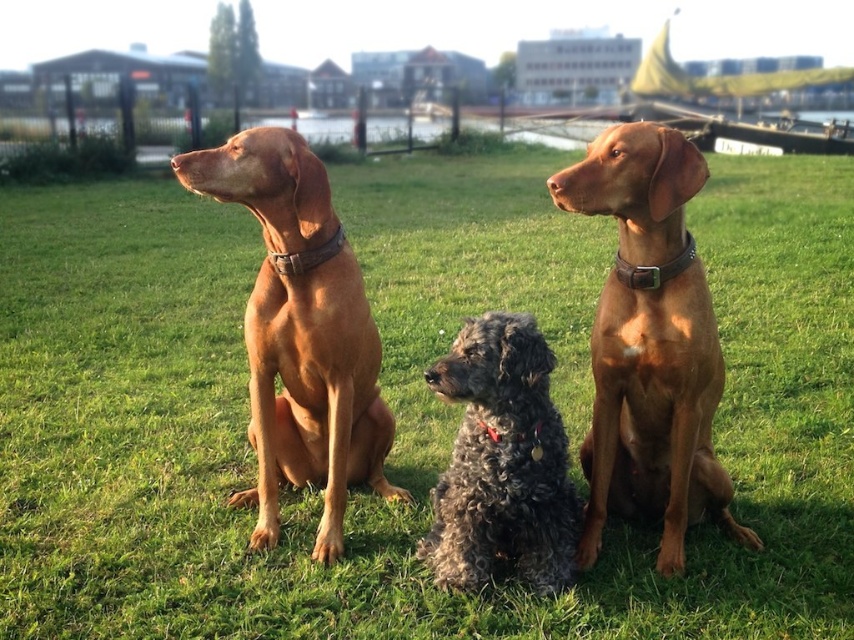
Is point (607, 364) positioned behind point (306, 369)?

No.

Does matte brown dog at center have a lesser height compared to brown leather dog at left?

Yes.

Between point (617, 205) and point (314, 330), which one is positioned behind?

The point (314, 330) is more distant.

This screenshot has width=854, height=640. I want to click on matte brown dog at center, so click(x=650, y=344).

Which is above, matte brown dog at center or curly gray fur at center?

Positioned higher is matte brown dog at center.

This screenshot has width=854, height=640. What do you see at coordinates (650, 344) in the screenshot? I see `matte brown dog at center` at bounding box center [650, 344].

This screenshot has height=640, width=854. Identify the location of matte brown dog at center. (650, 344).

Is point (319, 346) behind point (568, 532)?

Yes, it is behind point (568, 532).

Who is shorter, brown leather dog at left or curly gray fur at center?

Standing shorter between the two is curly gray fur at center.

You are a GUI agent. You are given a task and a screenshot of the screen. Output one action in this format:
    pyautogui.click(x=<x>, y=<y>)
    Task: Click on the brown leather dog at left
    The width and height of the screenshot is (854, 640).
    Given the screenshot: What is the action you would take?
    pyautogui.click(x=301, y=333)